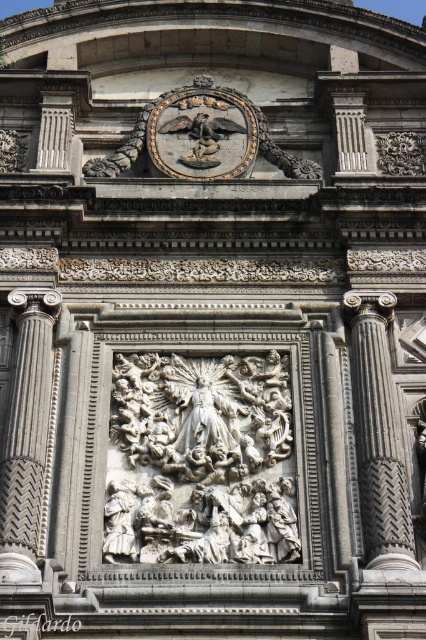
You are an architect analyzing the facade and need to place a new decorative element. The new element must be positioned to the right of the white marble sculpture at center. According to the coordinates provided, where should the new element be placed?

The white marble sculpture at center is located at point (201, 460). To place the new element to the right of it, the x coordinate should be greater than 0.720 while keeping the y coordinate around 0.472.

You are an art conservator examining the facade. You need to clean the gray stone column at left and the white marble sculpture at center. Based on their positions, which object will require you to move further back to access?

The gray stone column at left is behind the white marble sculpture at center, so you will need to move further back to access the gray stone column at left.